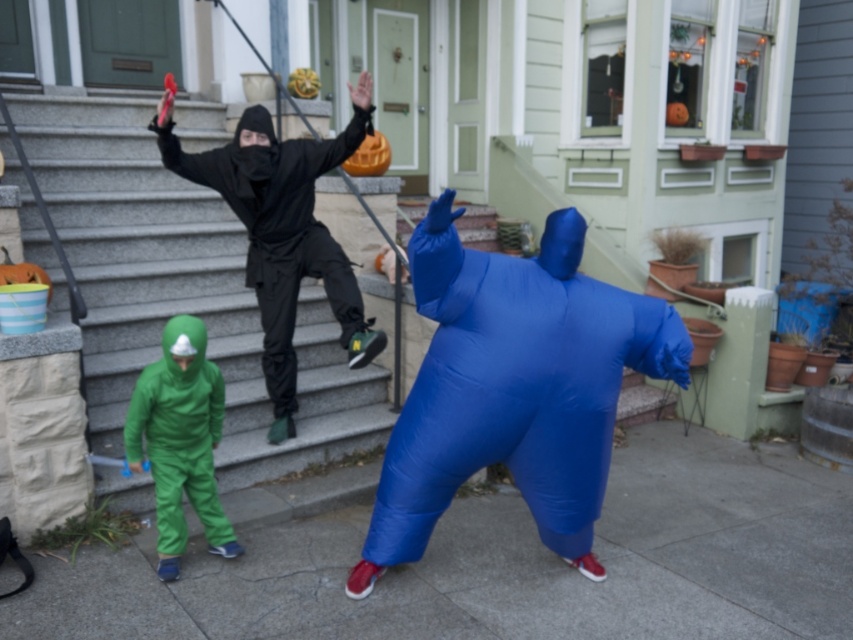
You are a delivery person trying to reach the front door of the house. The blue inflatable at center and the green matte suit at lower left are blocking your path. Which object should you move first to clear the path?

The blue inflatable at center is in front of the green matte suit at lower left, so you should move the blue inflatable at center first to clear the path.

You are a parent trying to decide whether to let your child play near the smooth concrete stairs at upper center and the blue inflatable at center. Based on their heights, which one is safer for the child to play around?

The blue inflatable at center is shorter than the smooth concrete stairs at upper center, so it is safer for the child to play around the blue inflatable at center.

In the scene shown: You are a delivery person trying to deliver a package to the house. You see the smooth concrete stairs at upper center and the green matte suit at lower left. Which object is wider from your perspective?

The smooth concrete stairs at upper center might be wider than green matte suit at lower left.